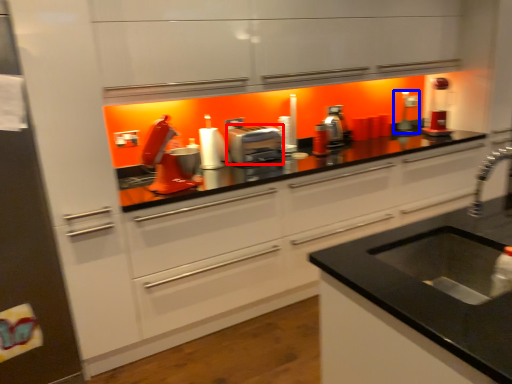
Question: Which object appears closest to the camera in this image, kitchen appliance (highlighted by a red box) or appliance (highlighted by a blue box)?

Choices:
 (A) kitchen appliance
 (B) appliance

Answer: (A)